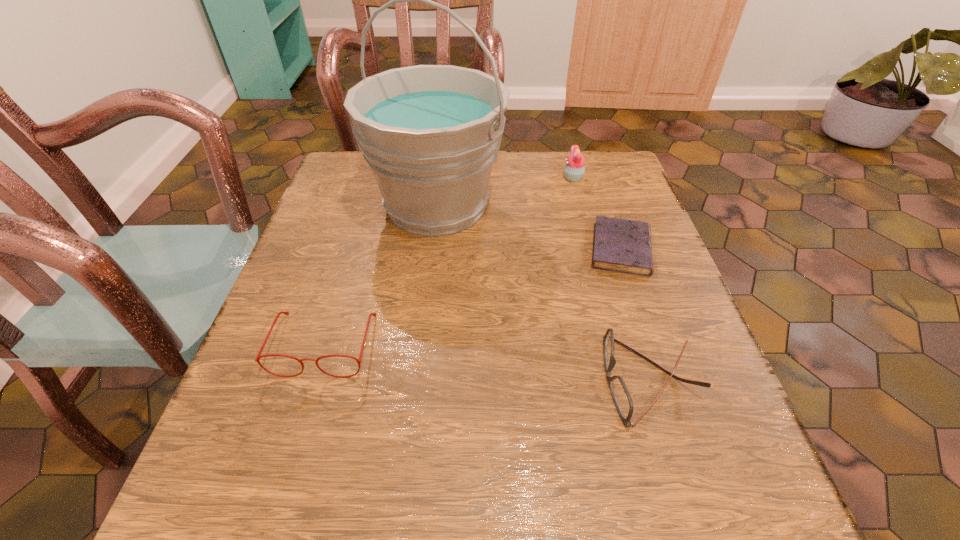
Identify the location of cupcake that is at the right edge. (574, 169).

Locate an element on the screen. Image resolution: width=960 pixels, height=540 pixels. spectacles that is at the right edge is located at coordinates (620, 393).

I want to click on diary located in the right edge section of the desktop, so click(619, 245).

Identify the location of object situated at the far left corner. (430, 134).

What are the coordinates of `object situated at the far right corner` in the screenshot? It's located at (574, 169).

Find the location of a particular element. free space at the far edge of the desktop is located at coordinates (497, 192).

Identify the location of vacant space at the near edge. point(602,482).

Locate an element on the screen. free space at the left edge is located at coordinates (364, 208).

You are a GUI agent. You are given a task and a screenshot of the screen. Output one action in this format:
    pyautogui.click(x=<x>, y=<y>)
    Task: Click on the vacant space at the right edge of the desktop
    The image size is (960, 540).
    Given the screenshot: What is the action you would take?
    pyautogui.click(x=605, y=279)

Where is `vacant space at the far left corner of the desktop`? This screenshot has height=540, width=960. vacant space at the far left corner of the desktop is located at coordinates (345, 201).